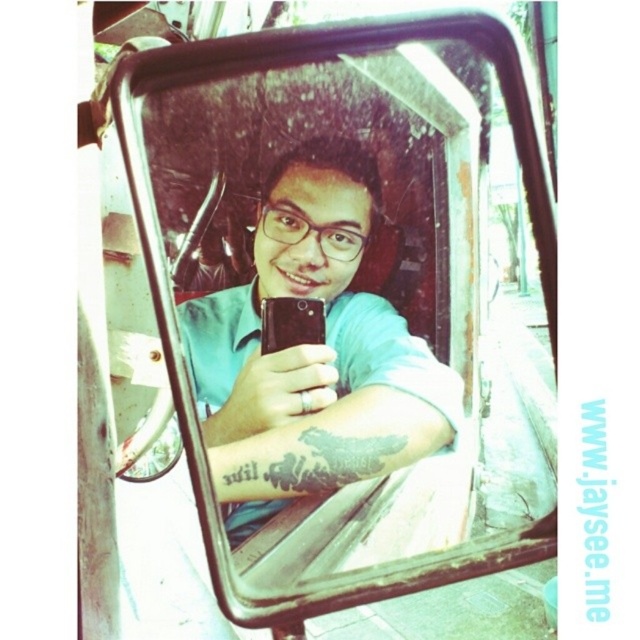
You are a photographer standing 2 feet away from the clear glass mirror at center in the car. You want to take a photo of the mirror to capture its reflection clearly. Considering the mirror is 22.80 inches away from you, is the distance sufficient to frame the mirror properly?

The clear glass mirror at center is 22.80 inches away from the viewer. Since 2 feet equals 24 inches, you are standing slightly closer than the mirror distance. To frame it properly, you might need to step back a bit to ensure the entire mirror fits in the camera frame.

You are a photographer trying to capture a reflection in the clear glass mirror at center. You have a matte black phone at center in your hand. Since both are at the center, which object will be closer to the camera when you take the photo?

The clear glass mirror at center is bigger than the matte black phone at center, so the phone is closer to the camera.